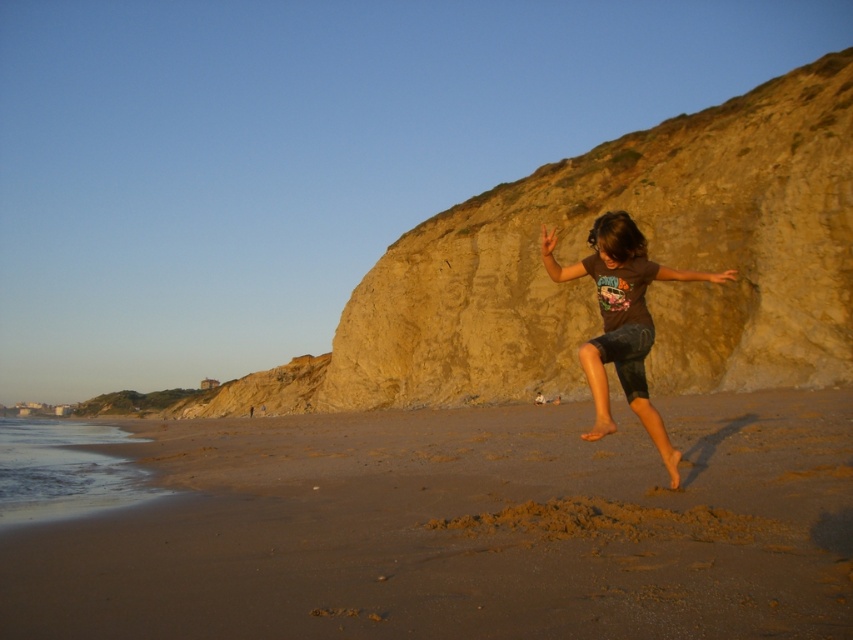
You are taking a photo of the beach scene. You notice two points in the image at coordinates point [347,444] and point [602,401]. Which point is closer to your camera?

Point [347,444] is further to the camera than point [602,401], so the closer point to the camera is point [602,401].